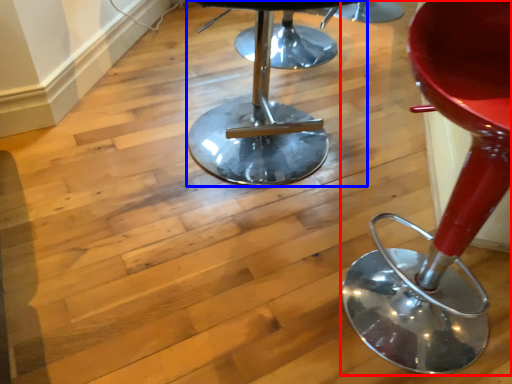
Question: Which object appears farthest to the camera in this image, chair (highlighted by a red box) or stool (highlighted by a blue box)?

Choices:
 (A) chair
 (B) stool

Answer: (B)